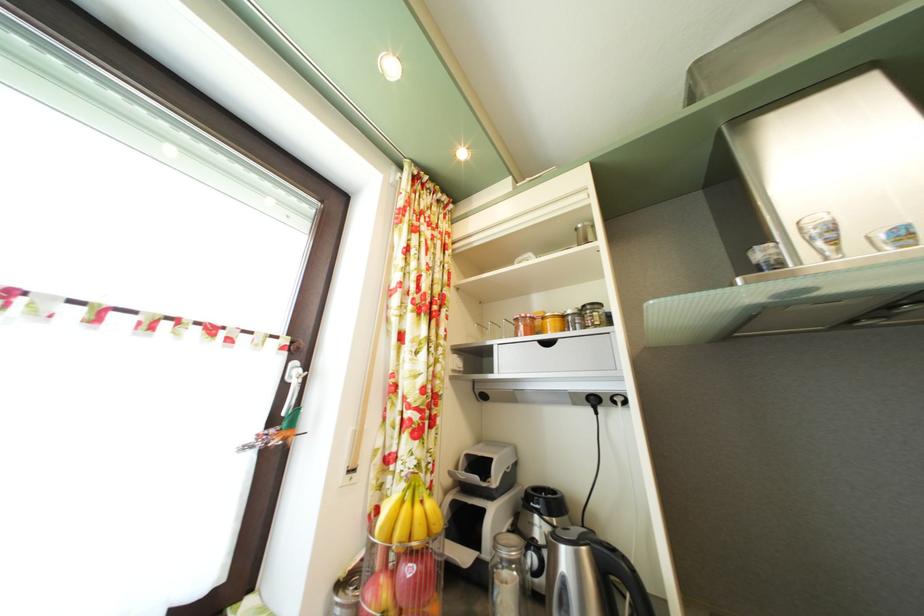
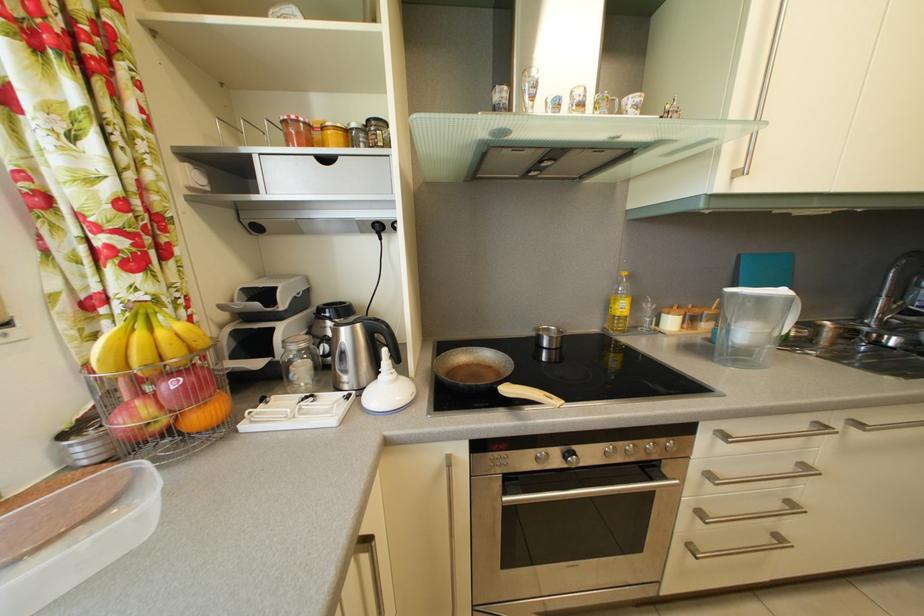
First-person continuous shooting, in which direction is the camera rotating?

The camera rotated toward right-down.